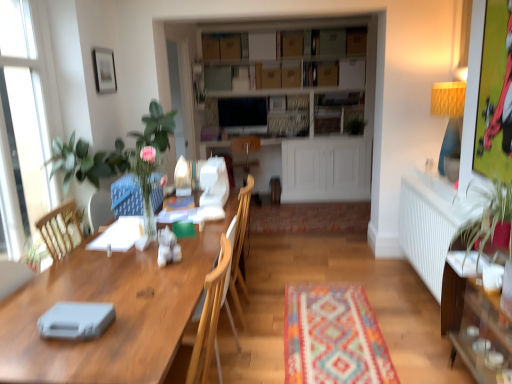
Question: Is white glass window at left completely or partially inside wooden armchair at center?

Choices:
 (A) yes
 (B) no

Answer: (B)

Question: Is wooden armchair at center positioned before white glass window at left?

Choices:
 (A) no
 (B) yes

Answer: (A)

Question: From the image's perspective, is wooden armchair at center beneath white glass window at left?

Choices:
 (A) yes
 (B) no

Answer: (A)

Question: Can you confirm if wooden armchair at center is smaller than white glass window at left?

Choices:
 (A) yes
 (B) no

Answer: (A)

Question: Is wooden armchair at center aimed at white glass window at left?

Choices:
 (A) no
 (B) yes

Answer: (B)

Question: In terms of width, does white glass window at left look wider or thinner when compared to cardboard boxes at center?

Choices:
 (A) thin
 (B) wide

Answer: (A)

Question: Is white glass window at left in front of or behind cardboard boxes at center in the image?

Choices:
 (A) front
 (B) behind

Answer: (A)

Question: From a real-world perspective, is white glass window at left physically located above or below cardboard boxes at center?

Choices:
 (A) above
 (B) below

Answer: (B)

Question: Is point (24, 71) closer or farther from the camera than point (326, 56)?

Choices:
 (A) closer
 (B) farther

Answer: (A)

Question: Choose the correct answer: Is white radiator at right inside matte black picture frame at upper left or outside it?

Choices:
 (A) inside
 (B) outside

Answer: (B)

Question: From the image's perspective, is white radiator at right positioned above or below matte black picture frame at upper left?

Choices:
 (A) below
 (B) above

Answer: (A)

Question: Is white radiator at right wider or thinner than matte black picture frame at upper left?

Choices:
 (A) wide
 (B) thin

Answer: (A)

Question: Is white radiator at right in front of or behind matte black picture frame at upper left in the image?

Choices:
 (A) behind
 (B) front

Answer: (B)

Question: From a real-world perspective, is cardboard boxes at center physically located above or below wooden table at center?

Choices:
 (A) above
 (B) below

Answer: (A)

Question: Is cardboard boxes at center inside the boundaries of wooden table at center, or outside?

Choices:
 (A) inside
 (B) outside

Answer: (B)